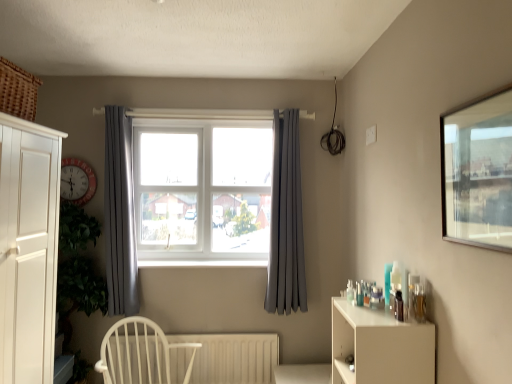
In order to click on matte red clock at left in this screenshot , I will do `click(77, 181)`.

Locate an element on the screen. satin grey curtain at center, which appears as the 1th curtain when viewed from the right is located at coordinates (286, 220).

What is the approximate width of white wood chair at lower left?

The width of white wood chair at lower left is 30.50 inches.

I want to click on gray fabric curtain at left, positioned as the first curtain in left-to-right order, so click(x=120, y=215).

This screenshot has width=512, height=384. What are the coordinates of `shelf above the white wood chair at lower left (from the image's perspective)` in the screenshot? It's located at (380, 347).

Which object is thinner, white wood chair at lower left or white matte shelf at right?

white matte shelf at right is thinner.

From a real-world perspective, is gray fabric curtain at left, positioned as the first curtain in left-to-right order, over white plastic window at center?

Actually, gray fabric curtain at left, positioned as the first curtain in left-to-right order, is physically below white plastic window at center in the real world.

Considering the positions of points (116, 200) and (162, 242), is point (116, 200) closer to camera compared to point (162, 242)?

Yes, it is.

Between gray fabric curtain at left, placed as the second curtain when sorted from right to left, and white plastic window at center, which one has smaller width?

With smaller width is gray fabric curtain at left, placed as the second curtain when sorted from right to left.

Consider the image. From the image's perspective, which object appears higher, gray fabric curtain at left, positioned as the first curtain in left-to-right order, or white plastic window at center?

From the image's view, white plastic window at center is above.

Based on the photo, can you confirm if transparent glass window at upper right is positioned to the left of gray fabric curtain at left, placed as the second curtain when sorted from right to left?

In fact, transparent glass window at upper right is to the right of gray fabric curtain at left, placed as the second curtain when sorted from right to left.

Does point (463, 216) appear closer or farther from the camera than point (112, 285)?

Point (463, 216) is positioned closer to the camera compared to point (112, 285).

Considering the sizes of objects transparent glass window at upper right and gray fabric curtain at left, placed as the second curtain when sorted from right to left, in the image provided, who is shorter, transparent glass window at upper right or gray fabric curtain at left, placed as the second curtain when sorted from right to left,?

Standing shorter between the two is transparent glass window at upper right.

From a real-world perspective, is transparent glass window at upper right physically below gray fabric curtain at left, placed as the second curtain when sorted from right to left?

No, from a real-world perspective, transparent glass window at upper right is not below gray fabric curtain at left, placed as the second curtain when sorted from right to left.

Which object is closer to the camera, matte red clock at left or transparent glass window at upper right?

Positioned in front is transparent glass window at upper right.

Is matte red clock at left oriented towards transparent glass window at upper right?

No, matte red clock at left is not aimed at transparent glass window at upper right.

Is matte red clock at left bigger or smaller than transparent glass window at upper right?

Considering their sizes, matte red clock at left takes up more space than transparent glass window at upper right.

Considering the sizes of objects matte red clock at left and transparent glass window at upper right in the image provided, who is wider, matte red clock at left or transparent glass window at upper right?

matte red clock at left is wider.

Identify the location of curtain on the right of white plastic window at center. This screenshot has height=384, width=512. (286, 220).

Is white plastic window at center completely or partially outside of satin grey curtain at center, which appears as the 1th curtain when viewed from the right?

white plastic window at center is positioned outside satin grey curtain at center, which appears as the 1th curtain when viewed from the right.

From the image's perspective, is white plastic window at center on satin grey curtain at center, the 2th curtain positioned from the left?

Yes, from the image's perspective, white plastic window at center is over satin grey curtain at center, the 2th curtain positioned from the left.

Is gray fabric curtain at left, positioned as the first curtain in left-to-right order, in front of or behind white wood chair at lower left in the image?

gray fabric curtain at left, positioned as the first curtain in left-to-right order, is positioned farther from the viewer than white wood chair at lower left.

Considering the positions of point (106, 265) and point (100, 363), is point (106, 265) closer or farther from the camera than point (100, 363)?

Clearly, point (106, 265) is more distant from the camera than point (100, 363).

Measure the distance from gray fabric curtain at left, positioned as the first curtain in left-to-right order, to white wood chair at lower left.

gray fabric curtain at left, positioned as the first curtain in left-to-right order, and white wood chair at lower left are 16.70 inches apart.

Is gray fabric curtain at left, positioned as the first curtain in left-to-right order, taller or shorter than white wood chair at lower left?

Clearly, gray fabric curtain at left, positioned as the first curtain in left-to-right order, is taller compared to white wood chair at lower left.

Between white plastic radiator at lower center and white wood chair at lower left, which one has more height?

white wood chair at lower left is taller.

How many degrees apart are the facing directions of white plastic radiator at lower center and white wood chair at lower left?

The angle between the facing direction of white plastic radiator at lower center and the facing direction of white wood chair at lower left is 33.4 degrees.

Is white plastic radiator at lower center behind white wood chair at lower left?

Yes, the depth of white plastic radiator at lower center is greater than that of white wood chair at lower left.

Which of these two, white plastic radiator at lower center or white wood chair at lower left, is smaller?

white plastic radiator at lower center is smaller.

At what (x,y) coordinates should I click in order to perform the action: click on chair below the white matte shelf at right (from a real-world perspective). Please return your answer as a coordinate pair (x, y). Image resolution: width=512 pixels, height=384 pixels. Looking at the image, I should click on (140, 354).

At what (x,y) coordinates should I click in order to perform the action: click on bay window above the gray fabric curtain at left, placed as the second curtain when sorted from right to left (from a real-world perspective). Please return your answer as a coordinate pair (x, y). Looking at the image, I should click on (203, 190).

In the scene shown: Which object lies further to the anchor point satin grey curtain at center, the 2th curtain positioned from the left, matte red clock at left or gray fabric curtain at left, positioned as the first curtain in left-to-right order?

The object further to satin grey curtain at center, the 2th curtain positioned from the left, is matte red clock at left.

Based on their spatial positions, is white matte shelf at right or white plastic radiator at lower center closer to transparent glass window at upper right?

white matte shelf at right is positioned closer to the anchor transparent glass window at upper right.

From the image, which object appears to be nearer to white plastic window at center, transparent glass window at upper right or satin grey curtain at center, the 2th curtain positioned from the left?

satin grey curtain at center, the 2th curtain positioned from the left, is closer to white plastic window at center.

Based on their spatial positions, is white matte shelf at right or white plastic radiator at lower center closer to matte red clock at left?

white plastic radiator at lower center.

Based on their spatial positions, is transparent glass window at upper right or gray fabric curtain at left, positioned as the first curtain in left-to-right order, closer to white wood chair at lower left?

gray fabric curtain at left, positioned as the first curtain in left-to-right order, is closer to white wood chair at lower left.

Estimate the real-world distances between objects in this image. Which object is closer to white plastic radiator at lower center, transparent glass window at upper right or white plastic window at center?

Based on the image, white plastic window at center appears to be nearer to white plastic radiator at lower center.

Based on their spatial positions, is gray fabric curtain at left, positioned as the first curtain in left-to-right order, or matte red clock at left further from white matte shelf at right?

matte red clock at left is positioned further to the anchor white matte shelf at right.

Considering their positions, is transparent glass window at upper right positioned further to white wood chair at lower left than white plastic window at center?

The object further to white wood chair at lower left is transparent glass window at upper right.

At what (x,y) coordinates should I click in order to perform the action: click on shelf between gray fabric curtain at left, placed as the second curtain when sorted from right to left, and transparent glass window at upper right, in the horizontal direction. Please return your answer as a coordinate pair (x, y). Looking at the image, I should click on (380, 347).

I want to click on bay window between matte red clock at left and white plastic radiator at lower center vertically, so click(203, 190).

Identify the location of radiator between transparent glass window at upper right and matte red clock at left along the z-axis. (224, 358).

In order to click on chair between gray fabric curtain at left, placed as the second curtain when sorted from right to left, and satin grey curtain at center, the 2th curtain positioned from the left, in the horizontal direction in this screenshot , I will do `click(140, 354)`.